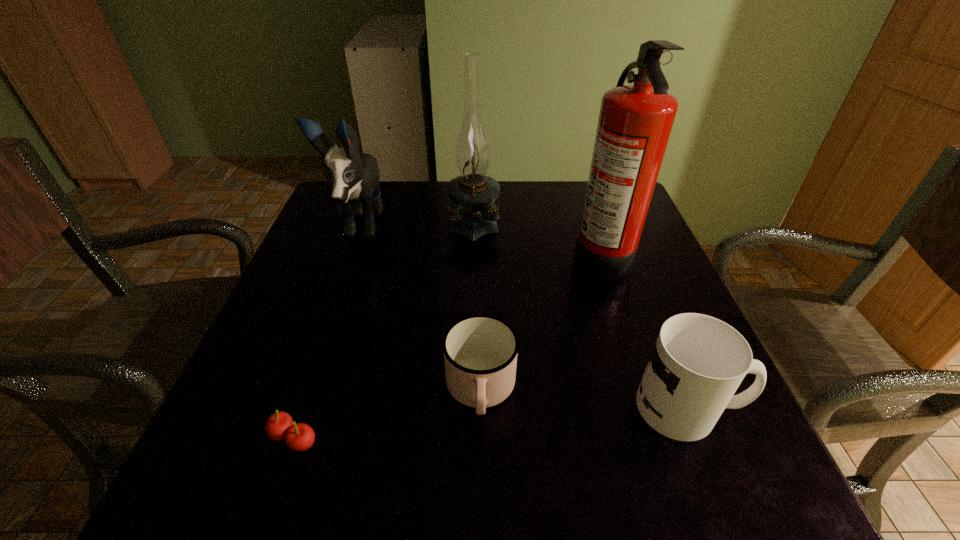
Select which object appears as the fourth closest to the puppy. Please provide its 2D coordinates. Your answer should be formatted as a tuple, i.e. [(x, y)], where the tuple contains the x and y coordinates of a point satisfying the conditions above.

[(635, 121)]

This screenshot has width=960, height=540. Identify the location of object that is the third nearest to the second tallest object. (480, 351).

The height and width of the screenshot is (540, 960). I want to click on vacant space that satisfies the following two spatial constraints: 1. on the front-facing side of the fire extinguisher; 2. on the side of the shorter mug with the handle, so click(645, 389).